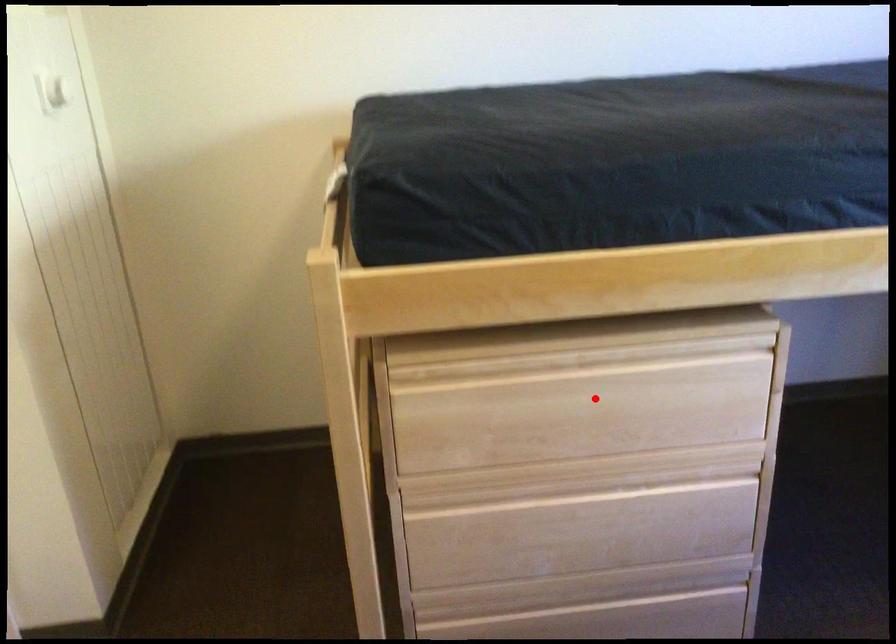
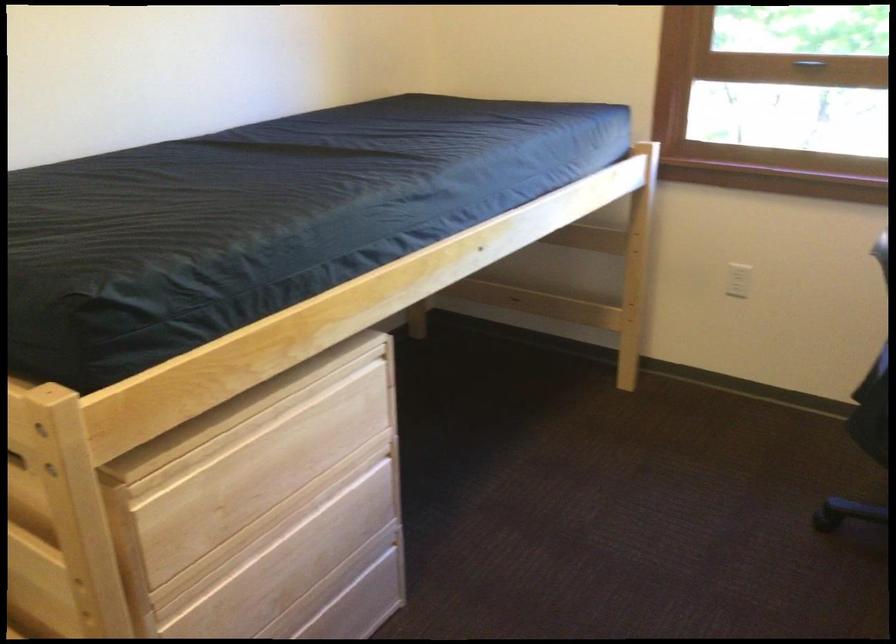
The point at the highlighted location is marked in the first image. Where is the corresponding point in the second image?

(285, 448)